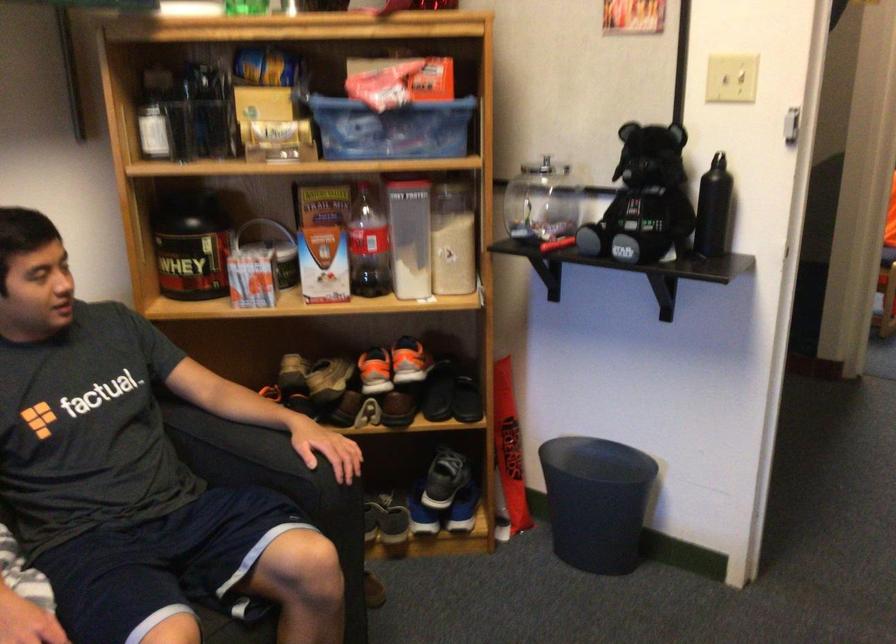
This screenshot has width=896, height=644. In order to click on black teddy bear in this screenshot , I will do `click(643, 200)`.